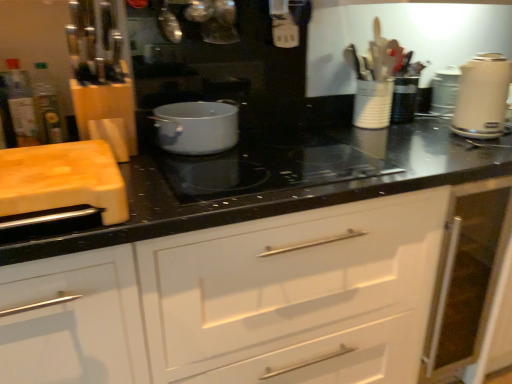
Identify the location of vacant area that is in front of white plastic toaster at upper right, which ranks as the 3th appliance in left-to-right order. The width and height of the screenshot is (512, 384). (465, 120).